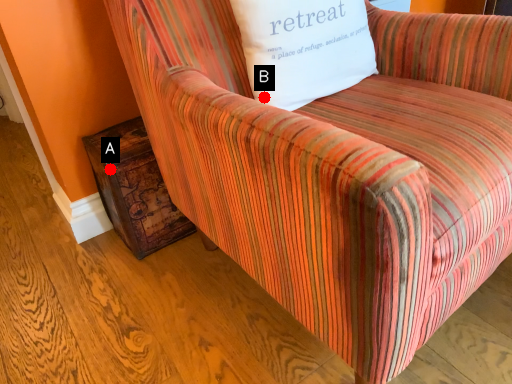
Question: Two points are circled on the image, labeled by A and B beside each circle. Which of the following is the closest to the observer?

Choices:
 (A) A is closer
 (B) B is closer

Answer: (B)